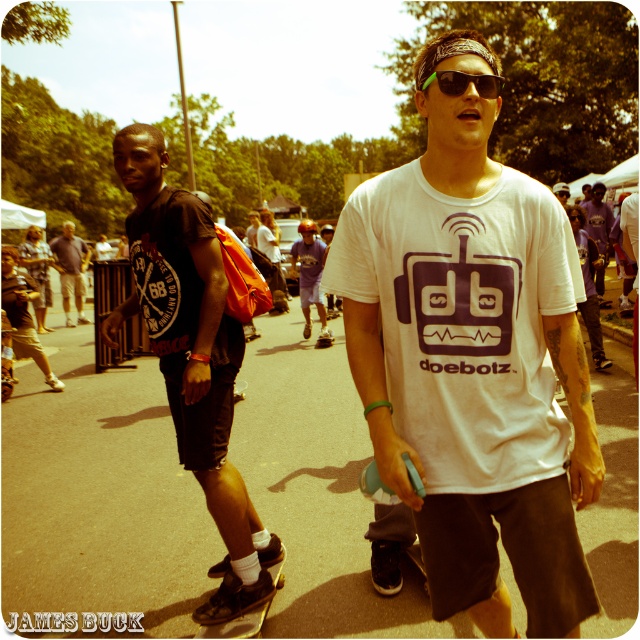
From the picture: You are a photographer at the skate park and need to capture a wide shot of the light blue denim shorts at center and the dark brown leather jacket at left. Given that your camera can only focus on objects wider than 30 cm, will both items be in focus?

The light blue denim shorts at center has a width less than the dark brown leather jacket at left. Since the camera requires objects wider than 30 cm to focus, only the dark brown leather jacket at left may be in focus if it meets the width requirement, but the light blue denim shorts at center might not due to its narrower width.

You are a photographer at the skate event. You want to take a photo of the black rubber skateboard at lower center and the sunglasses at center. The camera you are using has a minimum focus distance of 2 meters. Can you focus on both objects clearly at the same time?

The black rubber skateboard at lower center is 2.28 meters away from sunglasses at center. Since the minimum focus distance is 2 meters, the camera can focus on both objects clearly at the same time because the distance between them is within the required range.

You are standing at the center of the image and want to place your black rubber skateboard at lower center. Which direction should you move to reach it?

The black rubber skateboard at lower center is located at point (236, 625), so you should move to the lower right direction to reach it.